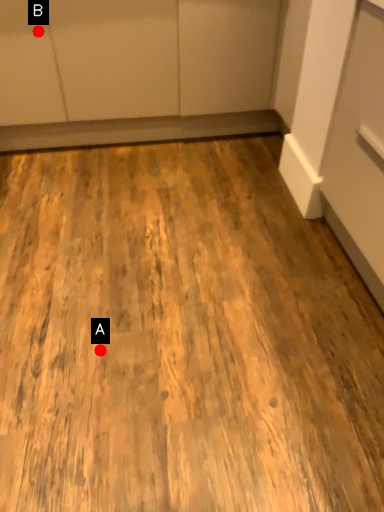
Question: Two points are circled on the image, labeled by A and B beside each circle. Which point is farther from the camera taking this photo?

Choices:
 (A) A is further
 (B) B is further

Answer: (B)